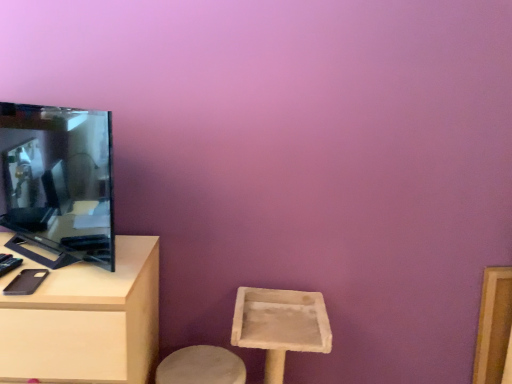
Where is `empty space that is ontop of light wood table at left`? The width and height of the screenshot is (512, 384). empty space that is ontop of light wood table at left is located at coordinates (51, 261).